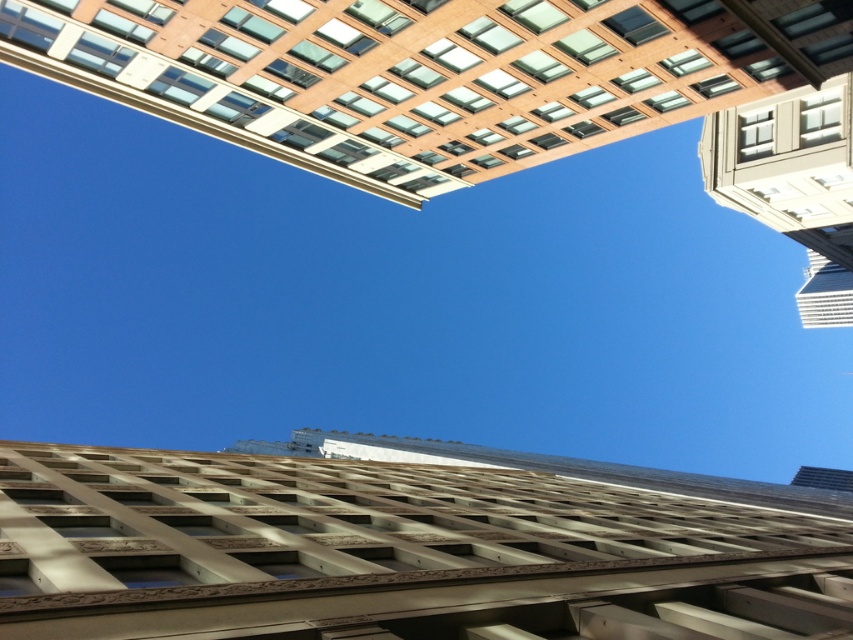
In the scene shown: Is the position of brown brick building at upper center less distant than that of white stone building at upper right?

That is True.

Is brown brick building at upper center further to camera compared to white stone building at upper right?

No, it is in front of white stone building at upper right.

Image resolution: width=853 pixels, height=640 pixels. What do you see at coordinates (427, 74) in the screenshot?
I see `brown brick building at upper center` at bounding box center [427, 74].

Locate an element on the screen. The width and height of the screenshot is (853, 640). brown brick building at upper center is located at coordinates (427, 74).

Can you confirm if beige textured facade at center is wider than brown brick building at upper center?

Yes.

Who is higher up, beige textured facade at center or brown brick building at upper center?

brown brick building at upper center

In order to click on beige textured facade at center in this screenshot , I will do `click(393, 552)`.

Find the location of a particular element. This screenshot has width=853, height=640. beige textured facade at center is located at coordinates (393, 552).

Which is behind, point (264, 500) or point (799, 180)?

Point (799, 180)

Does beige textured facade at center have a lesser height compared to white stone building at upper right?

Yes.

The image size is (853, 640). What are the coordinates of `beige textured facade at center` in the screenshot? It's located at (393, 552).

This screenshot has height=640, width=853. What are the coordinates of `beige textured facade at center` in the screenshot? It's located at (393, 552).